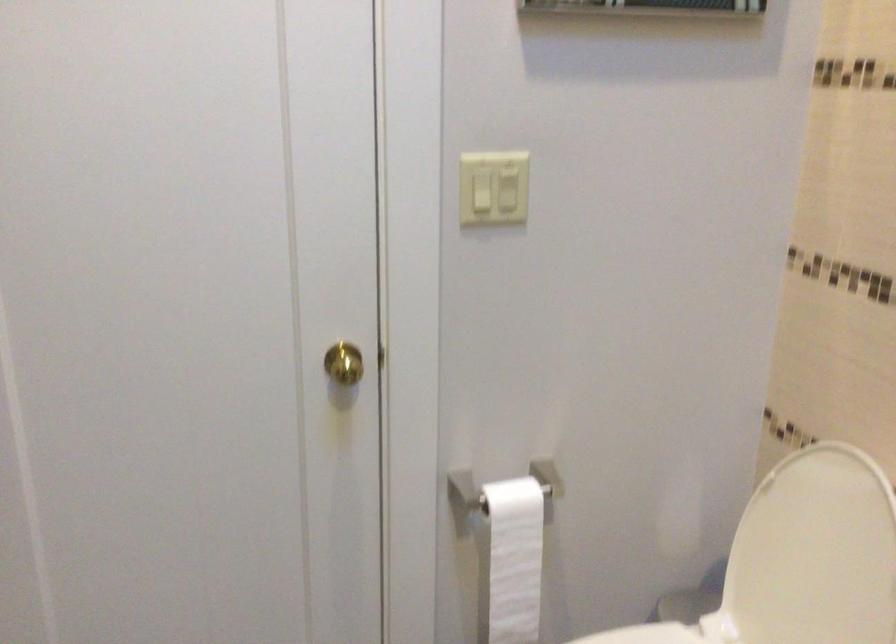
Find the location of a particular element. Image resolution: width=896 pixels, height=644 pixels. toilet seat is located at coordinates (645, 635).